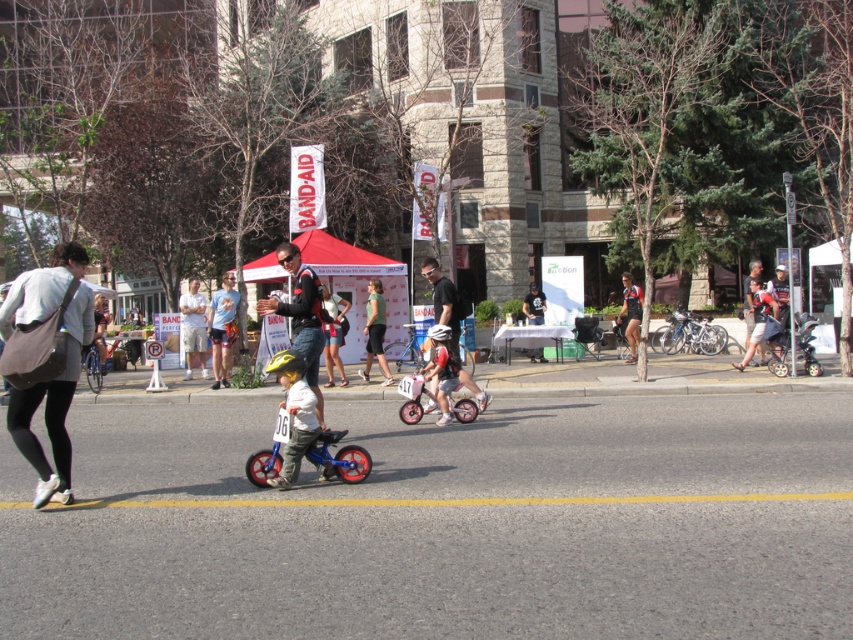
Question: Based on their relative distances, which object is farther from the black matte shirt at center?

Choices:
 (A) matte black shorts at center
 (B) light blue t-shirt at center
 (C) gray fabric bag at left
 (D) matte black shorts at right

Answer: (C)

Question: Can you confirm if white cotton shirt at center is positioned to the left of matte black shorts at center?

Choices:
 (A) no
 (B) yes

Answer: (B)

Question: Which point is farther to the camera?

Choices:
 (A) black matte shirt at center
 (B) gray fabric bag at left
 (C) light blue t-shirt at center

Answer: (A)

Question: Among these objects, which one is farthest from the camera?

Choices:
 (A) light blue t-shirt at center
 (B) matte black shorts at right
 (C) green matte shirt at center

Answer: (B)

Question: Where is matte black shorts at center located in relation to green matte shirt at center in the image?

Choices:
 (A) left
 (B) right

Answer: (B)

Question: Is gray fabric bag at left to the right of matte black shorts at center from the viewer's perspective?

Choices:
 (A) yes
 (B) no

Answer: (B)